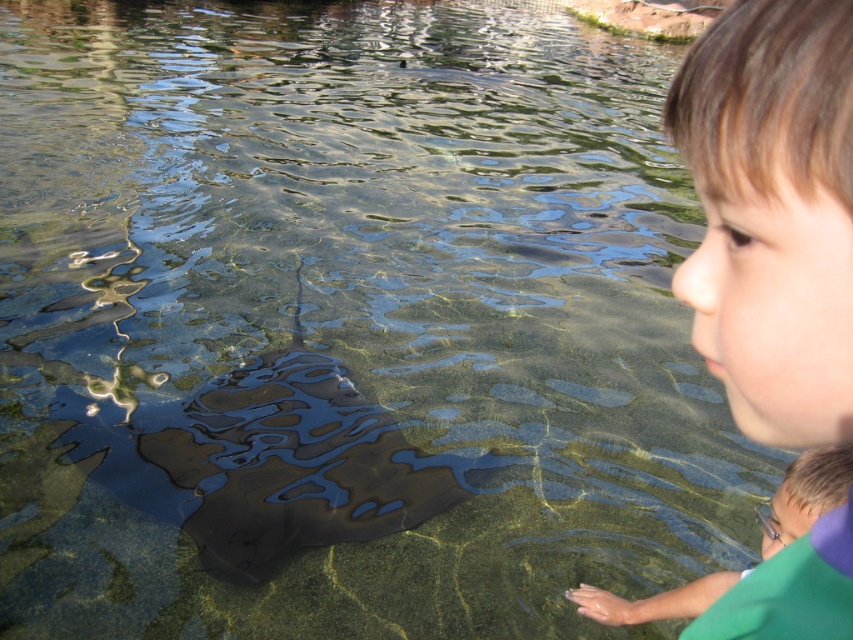
Does shiny black stingray at center appear on the right side of green matte shirt at lower right?

Incorrect, shiny black stingray at center is not on the right side of green matte shirt at lower right.

Which is behind, point (225, 515) or point (654, 608)?

Point (225, 515)

Who is more forward, (242, 365) or (846, 484)?

Point (846, 484) is more forward.

The height and width of the screenshot is (640, 853). I want to click on shiny black stingray at center, so click(279, 465).

Locate an element on the screen. The width and height of the screenshot is (853, 640). smooth skin face at upper right is located at coordinates (772, 212).

Is smooth skin face at upper right above green matte shirt at lower right?

Correct, smooth skin face at upper right is located above green matte shirt at lower right.

Is point (830, 76) farther from camera compared to point (788, 531)?

No, (830, 76) is in front of (788, 531).

You are a GUI agent. You are given a task and a screenshot of the screen. Output one action in this format:
    pyautogui.click(x=<x>, y=<y>)
    Task: Click on the smooth skin face at upper right
    The height and width of the screenshot is (640, 853).
    Given the screenshot: What is the action you would take?
    pyautogui.click(x=772, y=212)

Measure the distance between smooth skin face at upper right and shiny black stingray at center.

The distance of smooth skin face at upper right from shiny black stingray at center is 8.86 feet.

Is point (776, 342) in front of point (207, 410)?

That is True.

The image size is (853, 640). In order to click on smooth skin face at upper right in this screenshot , I will do `click(772, 212)`.

Where is `smooth skin face at upper right`? This screenshot has height=640, width=853. smooth skin face at upper right is located at coordinates (772, 212).